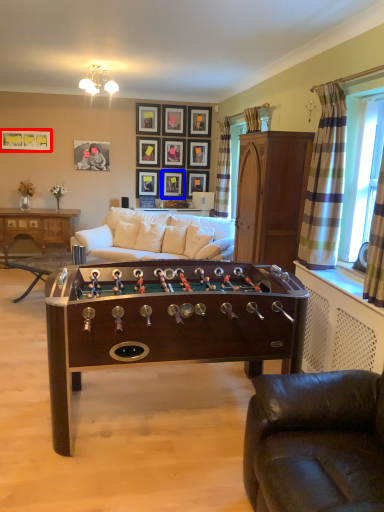
Question: Which object appears closest to the camera in this image, picture frame (highlighted by a red box) or picture frame (highlighted by a blue box)?

Choices:
 (A) picture frame
 (B) picture frame

Answer: (A)